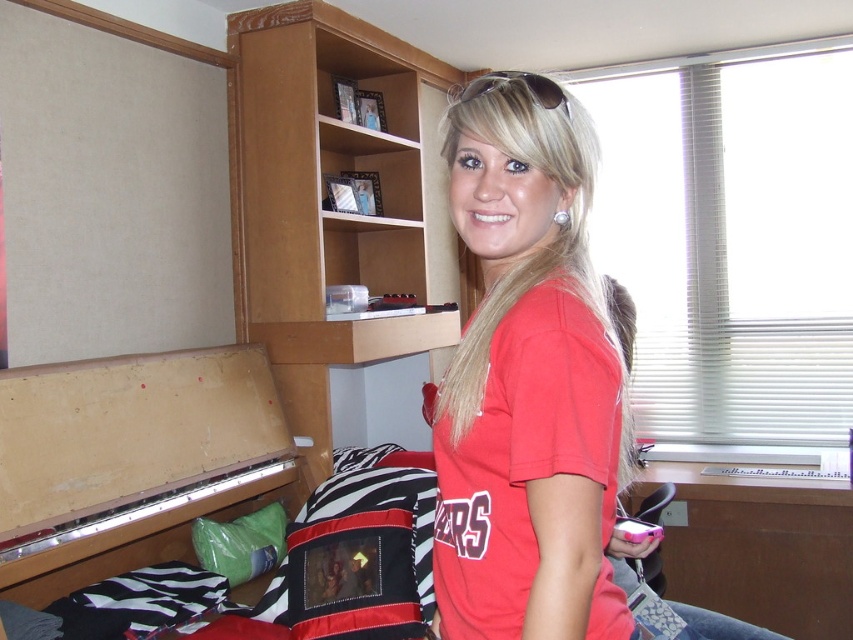
Question: Among these points, which one is farthest from the camera?

Choices:
 (A) (425, 225)
 (B) (532, 257)

Answer: (A)

Question: Is matte red t-shirt at center further to the viewer compared to wooden bookshelf at upper center?

Choices:
 (A) no
 (B) yes

Answer: (A)

Question: In this image, where is matte red t-shirt at center located relative to wooden bookshelf at upper center?

Choices:
 (A) right
 (B) left

Answer: (A)

Question: From the image, what is the correct spatial relationship of matte red t-shirt at center in relation to wooden bookshelf at upper center?

Choices:
 (A) left
 (B) right

Answer: (B)

Question: Which of the following is the closest to the observer?

Choices:
 (A) [x=339, y=51]
 (B) [x=541, y=321]

Answer: (B)